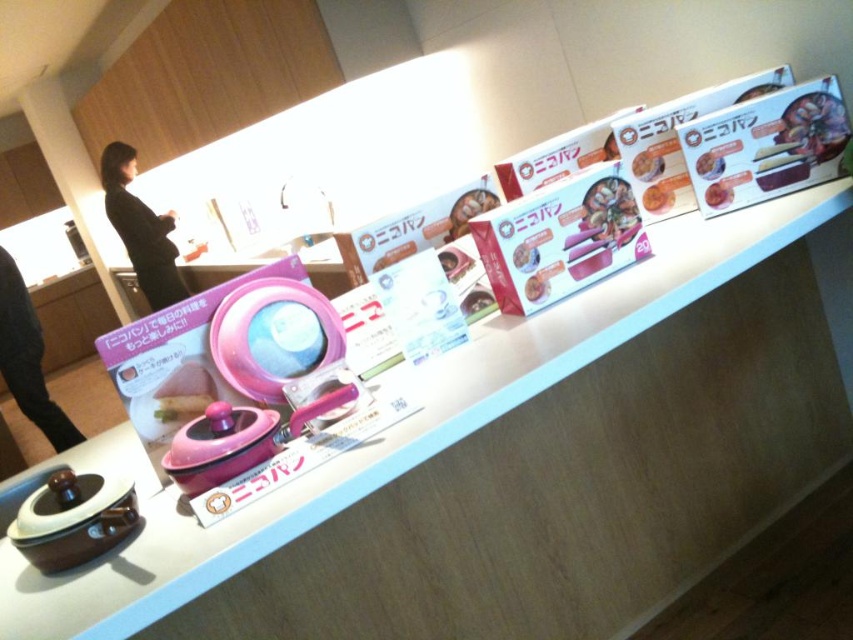
How distant is white glossy counter top at upper center from black fabric man at lower left?

9.02 feet

Consider the image. Does white glossy counter top at upper center have a larger size compared to black fabric man at lower left?

Yes, white glossy counter top at upper center is bigger than black fabric man at lower left.

Who is more distant from viewer, (x=32, y=584) or (x=38, y=330)?

The point (x=38, y=330) is behind.

Locate an element on the screen. The width and height of the screenshot is (853, 640). white glossy counter top at upper center is located at coordinates (508, 472).

Is black fabric man at lower left above matte pink rice cooker at upper center?

Incorrect, black fabric man at lower left is not positioned above matte pink rice cooker at upper center.

Describe the element at coordinates (27, 358) in the screenshot. I see `black fabric man at lower left` at that location.

Where is `black fabric man at lower left`? Image resolution: width=853 pixels, height=640 pixels. black fabric man at lower left is located at coordinates (27, 358).

Consider the image. Does black fabric at left have a greater height compared to black fabric man at lower left?

In fact, black fabric at left may be shorter than black fabric man at lower left.

Which is behind, point (152, 220) or point (12, 282)?

Point (152, 220)

Which is in front, point (138, 266) or point (73, 424)?

Point (73, 424) is in front.

Identify the location of black fabric at left. Image resolution: width=853 pixels, height=640 pixels. (140, 228).